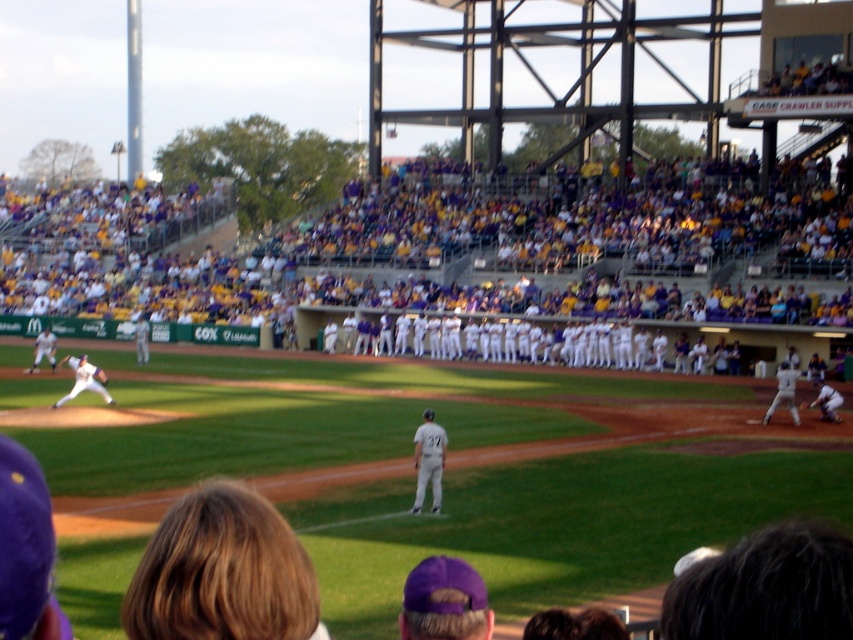
Question: Is white uniform at center closer to camera compared to white uniformed pitcher at left?

Choices:
 (A) yes
 (B) no

Answer: (A)

Question: Does white uniform at center lie in front of white uniformed pitcher at left?

Choices:
 (A) no
 (B) yes

Answer: (B)

Question: Which object is positioned farthest from the white uniform at right?

Choices:
 (A) white uniform at center
 (B) white uniformed pitcher at left
 (C) brown leather glove at lower right

Answer: (B)

Question: Among these points, which one is nearest to the camera?

Choices:
 (A) (432, 452)
 (B) (801, 408)
 (C) (82, 376)
 (D) (822, 410)

Answer: (A)

Question: Which point is farther to the camera?

Choices:
 (A) (418, 490)
 (B) (93, 372)
 (C) (807, 403)

Answer: (C)

Question: Is white uniform at right closer to the viewer compared to brown leather glove at lower right?

Choices:
 (A) no
 (B) yes

Answer: (B)